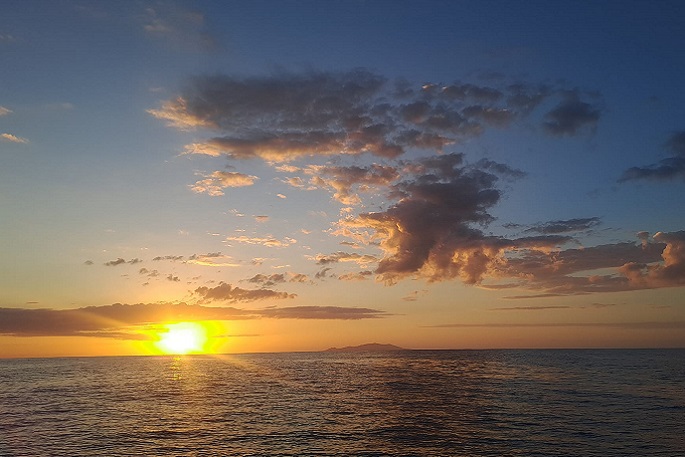
You are a GUI agent. You are given a task and a screenshot of the screen. Output one action in this format:
    pyautogui.click(x=<x>, y=<y>)
    Task: Click on the corner
    Image resolution: width=685 pixels, height=457 pixels.
    Given the screenshot: What is the action you would take?
    pyautogui.click(x=64, y=39)